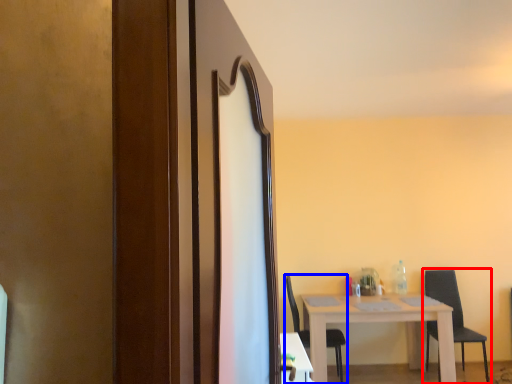
Question: Which of the following is the farthest to the observer, chair (highlighted by a red box) or chair (highlighted by a blue box)?

Choices:
 (A) chair
 (B) chair

Answer: (A)